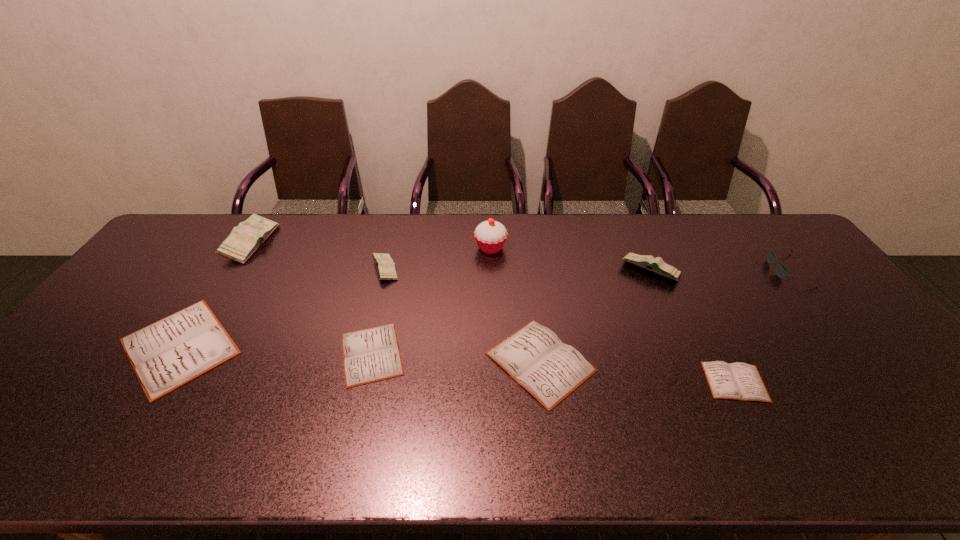
This screenshot has height=540, width=960. What are the coordinates of `pink cupcake` in the screenshot? It's located at point(490,235).

You are a GUI agent. You are given a task and a screenshot of the screen. Output one action in this format:
    pyautogui.click(x=<x>, y=<y>)
    Task: Click on the cupcake
    
    Given the screenshot: What is the action you would take?
    pyautogui.click(x=490, y=235)

You are a GUI agent. You are given a task and a screenshot of the screen. Output one action in this format:
    pyautogui.click(x=<x>, y=<y>)
    Task: Click on the tallest diary
    Image resolution: width=960 pixels, height=540 pixels.
    Given the screenshot: What is the action you would take?
    pyautogui.click(x=246, y=238)

Find the location of a particular element. the leftmost pink diary is located at coordinates (246, 238).

This screenshot has width=960, height=540. What are the coordinates of `the second biggest pink diary` in the screenshot? It's located at (657, 265).

Locate an element on the screen. The height and width of the screenshot is (540, 960). the seventh shortest object is located at coordinates (657, 265).

Find the location of `the rightmost object`. the rightmost object is located at coordinates (782, 271).

This screenshot has width=960, height=540. Identify the location of sunglasses. (782, 271).

In order to click on the fifth shortest diary in this screenshot , I will do `click(385, 267)`.

Locate an element on the screen. The width and height of the screenshot is (960, 540). the second pink diary from right to left is located at coordinates pyautogui.click(x=385, y=267).